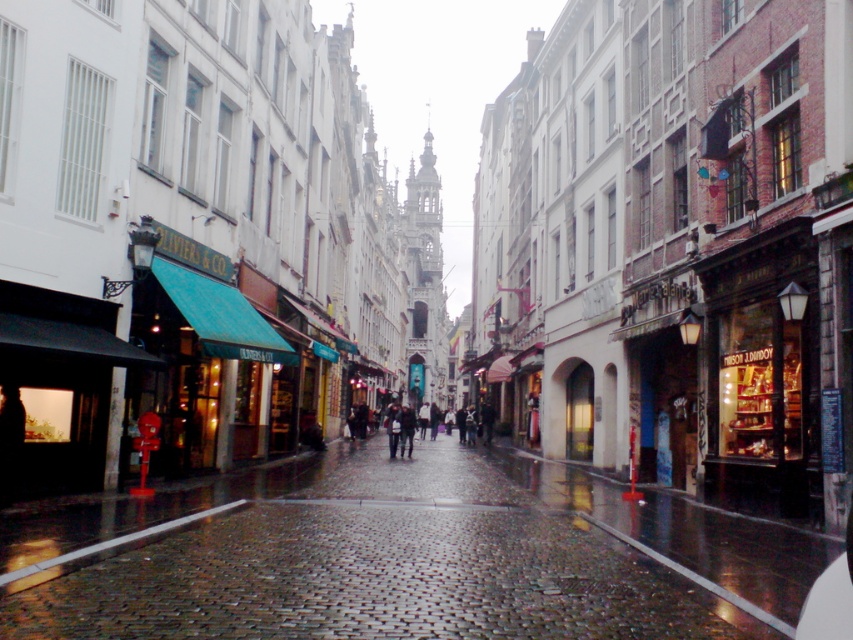
Question: Does cobblestone pavement at center appear under dark gray coat at center?

Choices:
 (A) no
 (B) yes

Answer: (A)

Question: Which point is farther from the camera taking this photo?

Choices:
 (A) (462, 580)
 (B) (402, 454)

Answer: (B)

Question: Which point is farther to the camera?

Choices:
 (A) dark gray coat at center
 (B) cobblestone pavement at center

Answer: (A)

Question: Can you confirm if cobblestone pavement at center is thinner than dark gray coat at center?

Choices:
 (A) no
 (B) yes

Answer: (A)

Question: Which point is closer to the camera taking this photo?

Choices:
 (A) (399, 416)
 (B) (596, 620)

Answer: (B)

Question: Can you confirm if cobblestone pavement at center is positioned above dark gray coat at center?

Choices:
 (A) yes
 (B) no

Answer: (A)